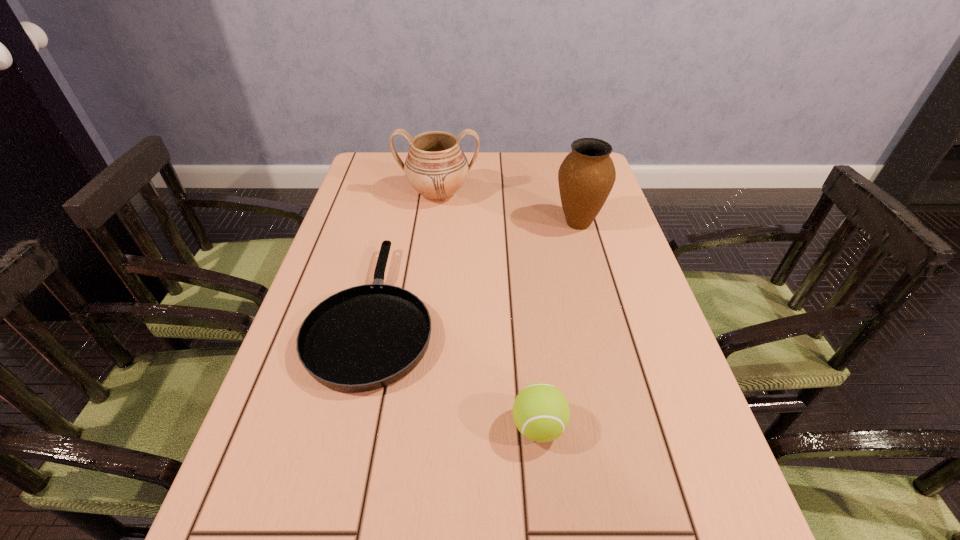
The height and width of the screenshot is (540, 960). Find the location of `vacant position located on the handle side of the frying pan`. vacant position located on the handle side of the frying pan is located at coordinates 396,224.

Find the location of a particular element. This screenshot has height=540, width=960. free location located 0.240m on the handle side of the frying pan is located at coordinates (401, 200).

Find the location of a particular element. The image size is (960, 540). object at the far edge is located at coordinates (436, 167).

At what (x,y) coordinates should I click in order to perform the action: click on urn present at the left edge. Please return your answer as a coordinate pair (x, y). The width and height of the screenshot is (960, 540). Looking at the image, I should click on (436, 167).

Find the location of a particular element. frying pan at the left edge is located at coordinates (366, 337).

Where is `object that is at the right edge`? object that is at the right edge is located at coordinates (586, 176).

I want to click on object that is at the far left corner, so click(x=436, y=167).

Identify the location of free space at the far edge of the desktop. This screenshot has height=540, width=960. (489, 156).

This screenshot has height=540, width=960. I want to click on free point at the left edge, so click(347, 223).

The width and height of the screenshot is (960, 540). In the image, there is a desktop. Identify the location of vacant space at the right edge. (668, 447).